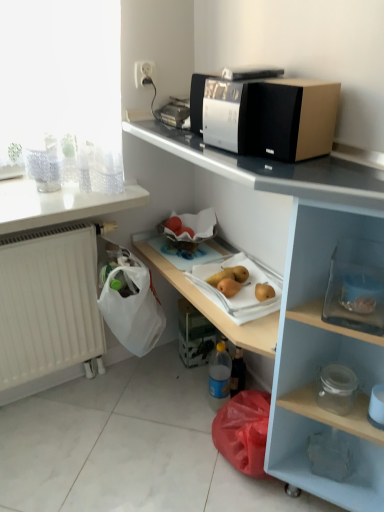
Image resolution: width=384 pixels, height=512 pixels. I want to click on vacant space that is to the left of translucent plastic container at lower center, acting as the second box starting from the top, so click(x=163, y=358).